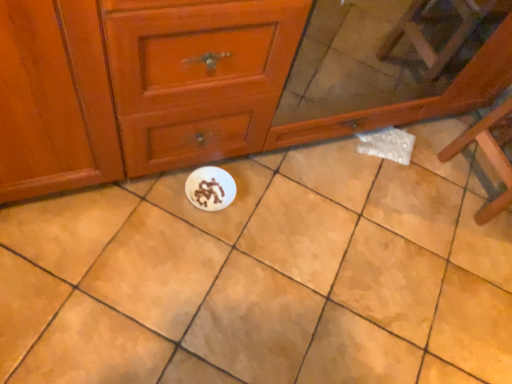
Locate an element on the screen. The height and width of the screenshot is (384, 512). free region on the left part of white matte paper plate at center is located at coordinates (161, 195).